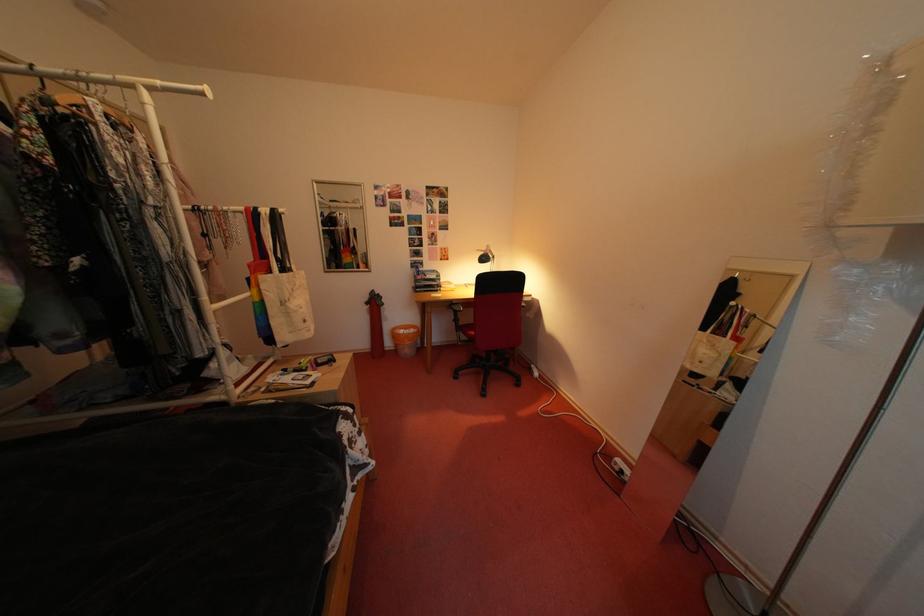
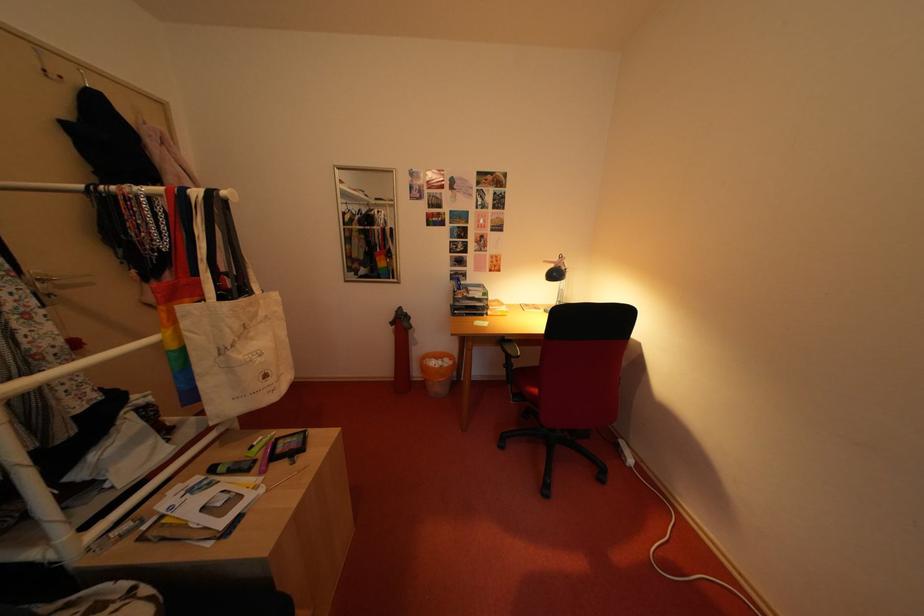
Question: I am providing you with two images of the same scene from different viewpoints. After the viewpoint changes to image2, which objects are now occluded?

Choices:
 (A) desk lamp head
 (B) orange trash can
 (C) white canvas tote bag
 (D) none of these

Answer: (D)